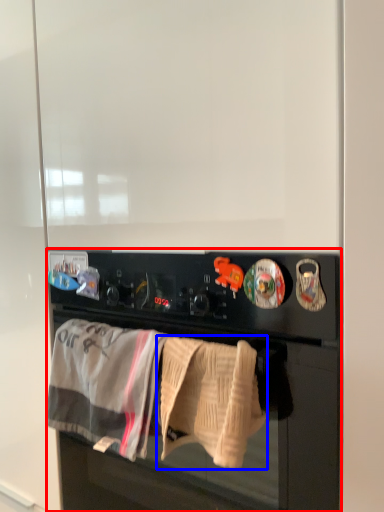
Question: Among these objects, which one is farthest to the camera, home appliance (highlighted by a red box) or bath towel (highlighted by a blue box)?

Choices:
 (A) home appliance
 (B) bath towel

Answer: (B)